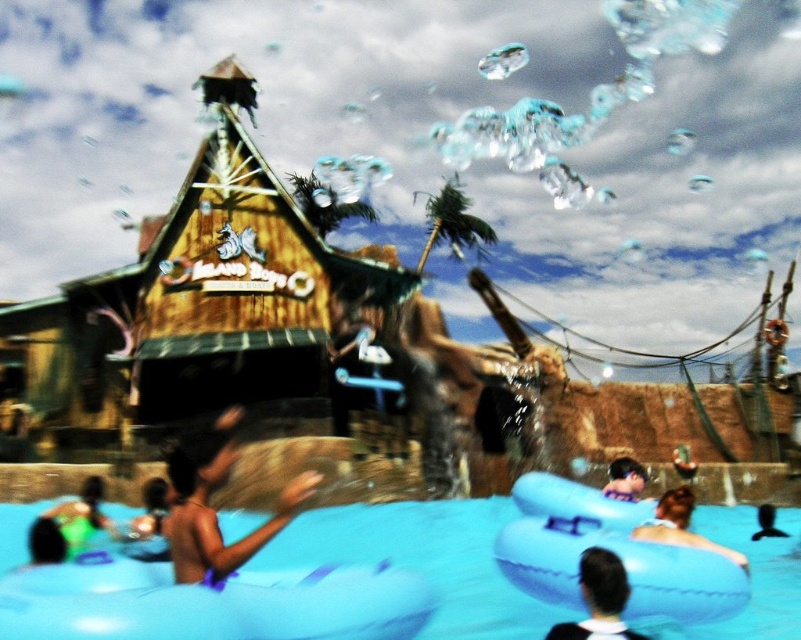
Is point (536, 624) closer to camera compared to point (590, 564)?

No.

Which of these two, blue rubber float at center or black matte hair at center, stands taller?

blue rubber float at center

Which is behind, point (718, 625) or point (566, 632)?

The point (718, 625) is more distant.

In order to click on blue rubber float at center in this screenshot , I will do `click(425, 561)`.

Can you confirm if blue rubber float at center is shorter than smooth blue float at center?

Incorrect, blue rubber float at center's height does not fall short of smooth blue float at center's.

From the picture: Between blue rubber float at center and smooth blue float at center, which one appears on the left side from the viewer's perspective?

blue rubber float at center is more to the left.

The image size is (801, 640). Describe the element at coordinates (425, 561) in the screenshot. I see `blue rubber float at center` at that location.

This screenshot has height=640, width=801. Find the location of `blue rubber float at center`. blue rubber float at center is located at coordinates (425, 561).

Is the position of black matte hair at center more distant than that of blonde hair at lower right?

No, black matte hair at center is closer to the viewer.

Is black matte hair at center below blonde hair at lower right?

Correct, black matte hair at center is located below blonde hair at lower right.

The image size is (801, 640). Find the location of `black matte hair at center`. black matte hair at center is located at coordinates (598, 600).

This screenshot has width=801, height=640. What are the coordinates of `black matte hair at center` in the screenshot? It's located at (598, 600).